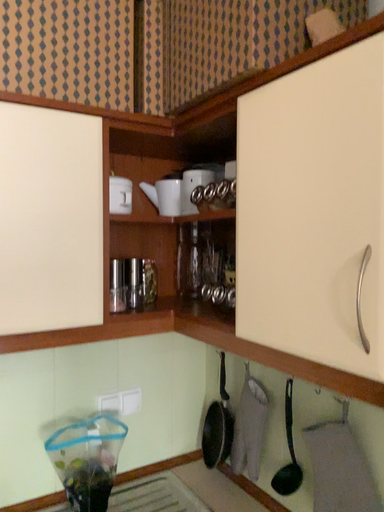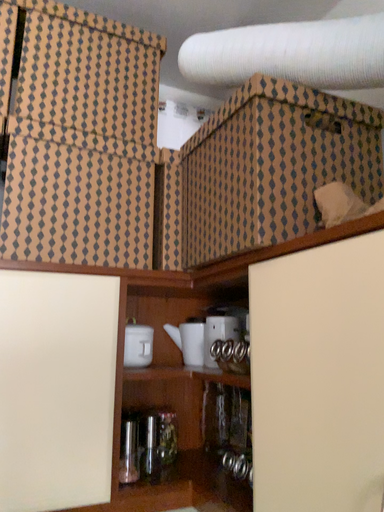
Question: Which way did the camera rotate in the video?

Choices:
 (A) rotated downward
 (B) rotated upward

Answer: (B)